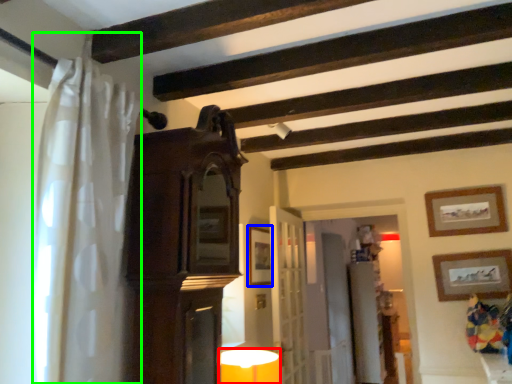
Question: Estimate the real-world distances between objects in this image. Which object is farther from table lamp (highlighted by a red box), picture frame (highlighted by a blue box) or shower curtain (highlighted by a green box)?

Choices:
 (A) picture frame
 (B) shower curtain

Answer: (B)